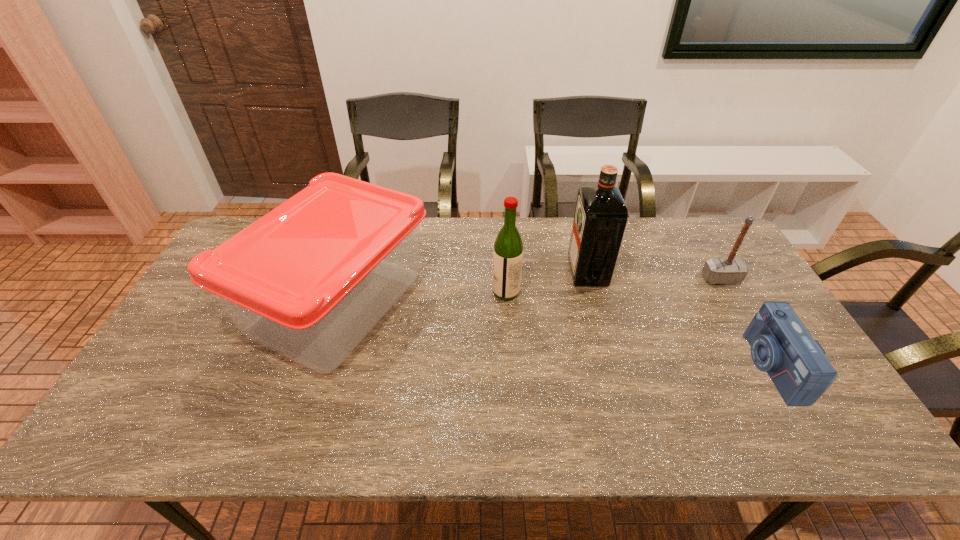
I want to click on camera that is positioned at the right edge, so click(781, 345).

I want to click on object situated at the far left corner, so click(310, 279).

This screenshot has height=540, width=960. Find the location of `free region at the far edge`. free region at the far edge is located at coordinates (651, 218).

You are a GUI agent. You are given a task and a screenshot of the screen. Output one action in this format:
    pyautogui.click(x=<x>, y=<y>)
    Task: Click on the vacant space at the near edge
    The image size is (960, 540).
    Given the screenshot: What is the action you would take?
    pyautogui.click(x=401, y=437)

I want to click on free space at the left edge, so click(x=179, y=330).

This screenshot has height=540, width=960. I want to click on unoccupied area between the leftmost object and the second shortest object, so click(x=529, y=291).

The image size is (960, 540). In order to click on free space between the leftmost object and the third object from right to left in this screenshot , I will do `click(463, 287)`.

Find the location of a particular element. free space that is in between the leftmost object and the hammer is located at coordinates (529, 291).

Identify the location of free space between the right liquor and the hammer. (655, 275).

In order to click on empty space that is in between the leftmost object and the right liquor in this screenshot , I will do `click(463, 287)`.